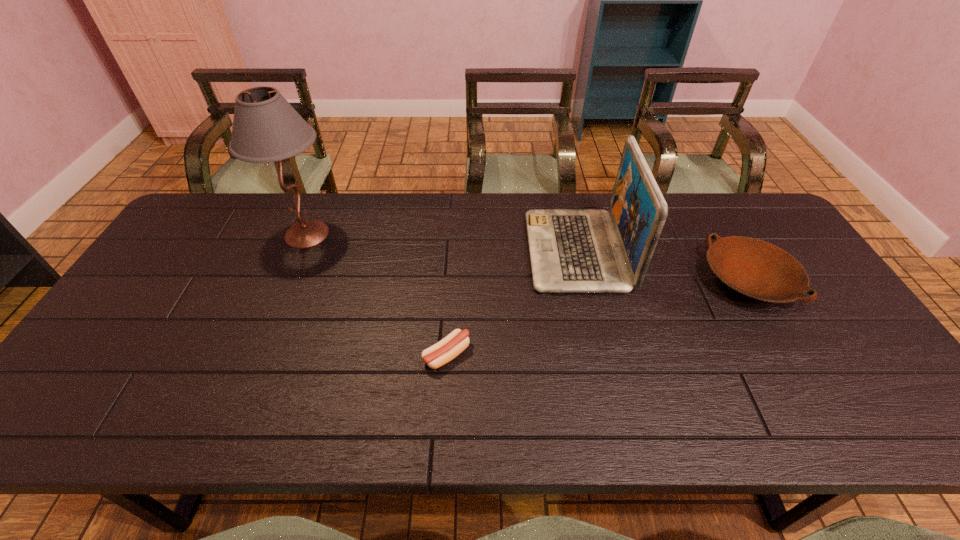
This screenshot has height=540, width=960. Find the location of `free region that satisfies the following two spatial constraints: 1. on the front-facing side of the tallest object; 2. on the right side of the plate`. free region that satisfies the following two spatial constraints: 1. on the front-facing side of the tallest object; 2. on the right side of the plate is located at coordinates (288, 280).

I want to click on free space that satisfies the following two spatial constraints: 1. on the back side of the sausage; 2. on the front-facing side of the tallest object, so click(454, 234).

You are a GUI agent. You are given a task and a screenshot of the screen. Output one action in this format:
    pyautogui.click(x=<x>, y=<y>)
    Task: Click on the free location that satisfies the following two spatial constraints: 1. on the front-facing side of the shortest object; 2. on the right side of the table lamp
    This screenshot has height=540, width=960.
    Given the screenshot: What is the action you would take?
    pyautogui.click(x=256, y=355)